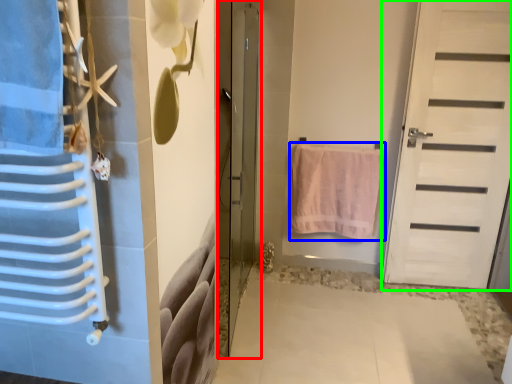
Question: Based on their relative distances, which object is nearer to door (highlighted by a red box)? Choose from towel (highlighted by a blue box) and door (highlighted by a green box).

Choices:
 (A) towel
 (B) door

Answer: (A)